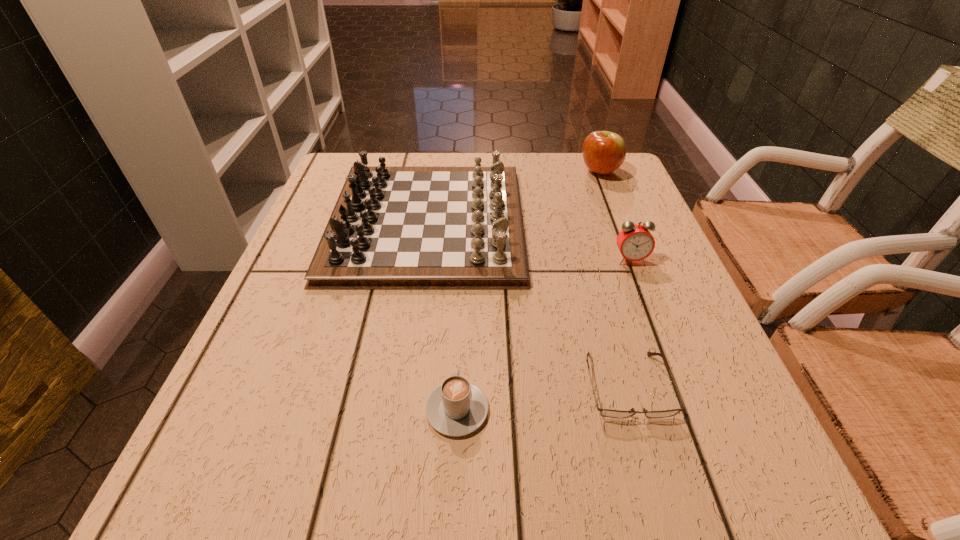
At what (x,y) coordinates should I click in order to perform the action: click on chessboard. Please return your answer as a coordinate pair (x, y). The width and height of the screenshot is (960, 540). Looking at the image, I should click on (393, 227).

I want to click on apple, so click(x=603, y=152).

I want to click on the third tallest object, so click(635, 242).

Where is `the second shortest object`? This screenshot has width=960, height=540. the second shortest object is located at coordinates (457, 407).

Identify the location of spectacles. (609, 413).

Image resolution: width=960 pixels, height=540 pixels. I want to click on vacant space situated 0.220m from the player's perspective of the chessboard, so click(x=616, y=222).

Identify the location of free point located on the left of the apple. This screenshot has width=960, height=540. (482, 172).

Where is `vacant space located 0.300m on the front-facing side of the third shortest object`? vacant space located 0.300m on the front-facing side of the third shortest object is located at coordinates (681, 391).

You are a GUI agent. You are given a task and a screenshot of the screen. Output one action in this format:
    pyautogui.click(x=<x>, y=<y>)
    Task: Click on the free location located 0.370m to the right of the second shortest object
    
    Given the screenshot: What is the action you would take?
    pyautogui.click(x=465, y=241)

At what (x,y) coordinates should I click in order to perform the action: click on vacant region located to the right of the second shortest object. Please return your answer as a coordinate pair (x, y). This screenshot has height=540, width=960. Looking at the image, I should click on (462, 295).